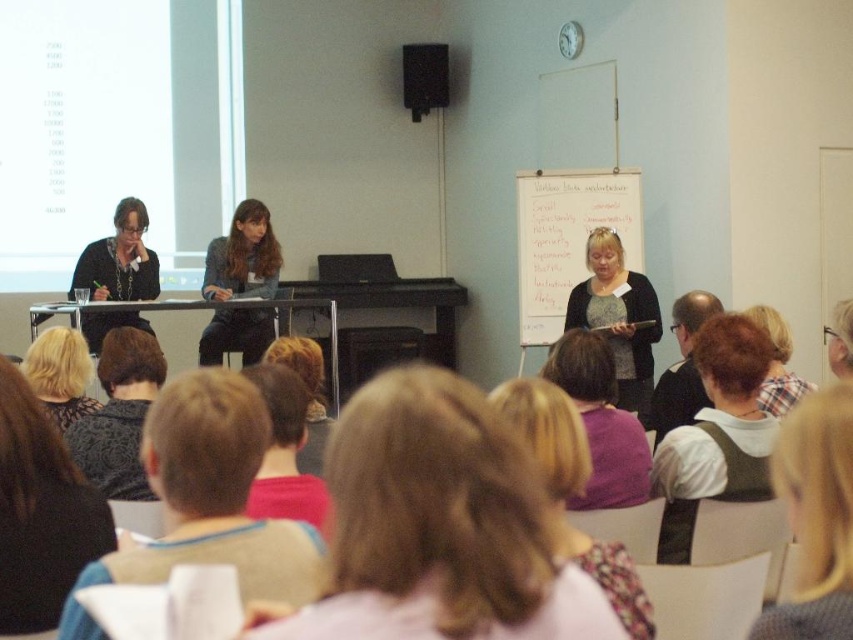
Does floral-patterned blouse at center have a lesser height compared to glossy plastic glasses at upper right?

In fact, floral-patterned blouse at center may be taller than glossy plastic glasses at upper right.

Who is more forward, (558,529) or (845,308)?

Positioned in front is point (558,529).

Which is behind, point (607, 548) or point (836, 326)?

Positioned behind is point (836, 326).

The image size is (853, 640). I want to click on floral-patterned blouse at center, so click(x=572, y=492).

Does point (0, 484) come in front of point (650, 605)?

That is False.

Does black lace dress at lower left have a smaller size compared to floral-patterned blouse at center?

Indeed, black lace dress at lower left has a smaller size compared to floral-patterned blouse at center.

Find the location of a particular element. This screenshot has width=853, height=640. black lace dress at lower left is located at coordinates (39, 513).

At what (x,y) coordinates should I click in order to perform the action: click on black lace dress at lower left. Please return your answer as a coordinate pair (x, y). The image size is (853, 640). Looking at the image, I should click on coord(39,513).

Can you confirm if purple sweater at center is wider than dark gray sweater at lower left?

In fact, purple sweater at center might be narrower than dark gray sweater at lower left.

Is purple sweater at center to the left of dark gray sweater at lower left from the viewer's perspective?

In fact, purple sweater at center is to the right of dark gray sweater at lower left.

Does point (611, 496) come farther from viewer compared to point (140, 401)?

No, it is not.

You are a GUI agent. You are given a task and a screenshot of the screen. Output one action in this format:
    pyautogui.click(x=<x>, y=<y>)
    Task: Click on the purple sweater at center
    Image resolution: width=853 pixels, height=640 pixels.
    Given the screenshot: What is the action you would take?
    pyautogui.click(x=601, y=422)